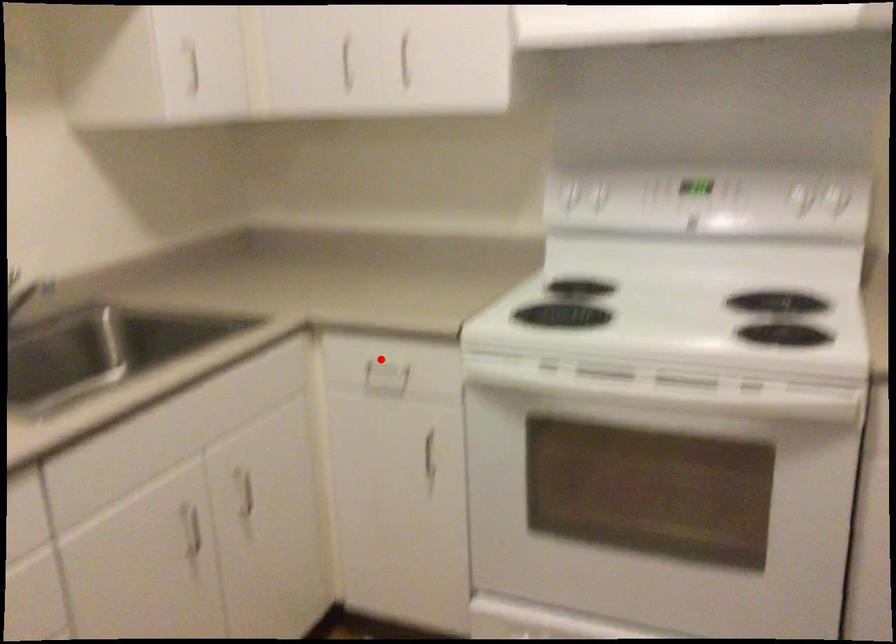
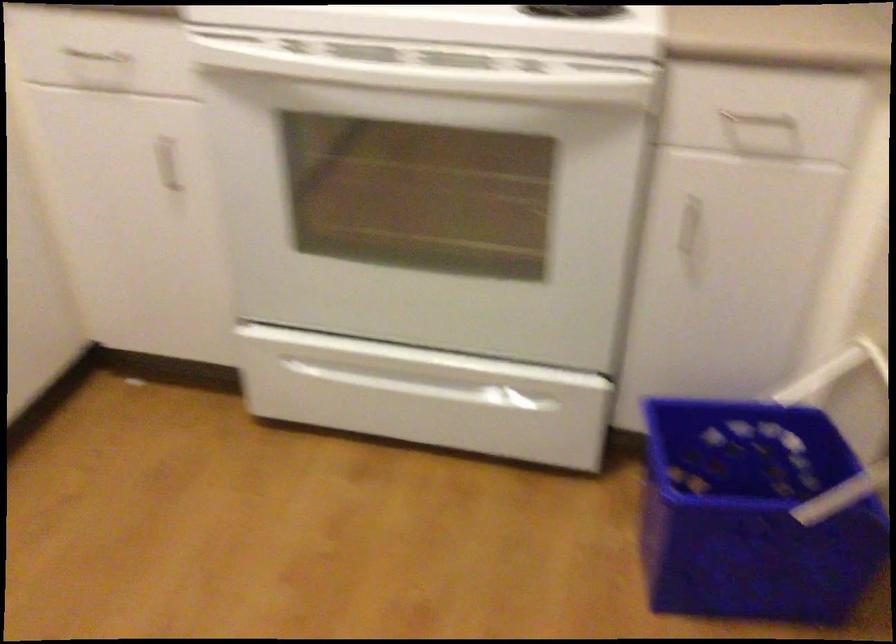
Question: I am providing you with two images of the same scene from different viewpoints. A red point is shown in image1. For the corresponding object point in image2, is it positioned nearer or farther from the camera?

Choices:
 (A) Nearer
 (B) Farther

Answer: (A)